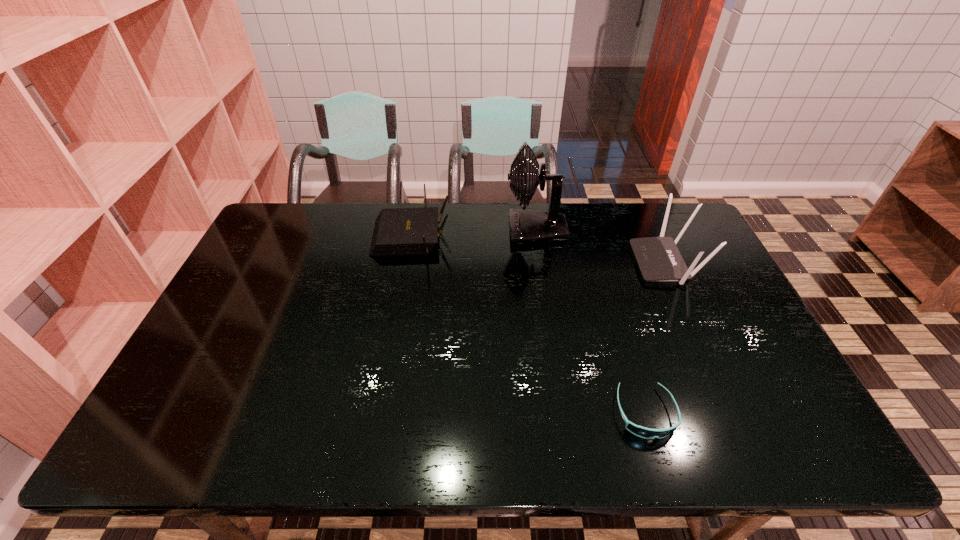
I want to click on free space between the second object from right to left and the third shortest object, so click(x=656, y=338).

The image size is (960, 540). Find the location of `vacant space that's between the nearest object and the shorter router`. vacant space that's between the nearest object and the shorter router is located at coordinates (528, 325).

Identify the location of vacant area that lies between the sunglasses and the taller router. The height and width of the screenshot is (540, 960). (656, 338).

At what (x,y) coordinates should I click in order to perform the action: click on empty space between the taller router and the third object from left to right. Please return your answer as a coordinate pair (x, y). The image size is (960, 540). Looking at the image, I should click on (656, 338).

Find the location of a particular element. The image size is (960, 540). free spot between the sunglasses and the second tallest object is located at coordinates (656, 338).

I want to click on the closest object relative to the tallest object, so click(x=398, y=231).

Locate which object ranks second in proximity to the shortest object. Please provide its 2D coordinates. Your answer should be formatted as a tuple, i.e. [(x, y)], where the tuple contains the x and y coordinates of a point satisfying the conditions above.

[(526, 226)]

Where is `vacant space that satisfies the following two spatial constraints: 1. on the front-facing side of the right router; 2. on the front-facing side of the shortest object`? Image resolution: width=960 pixels, height=540 pixels. vacant space that satisfies the following two spatial constraints: 1. on the front-facing side of the right router; 2. on the front-facing side of the shortest object is located at coordinates (732, 413).